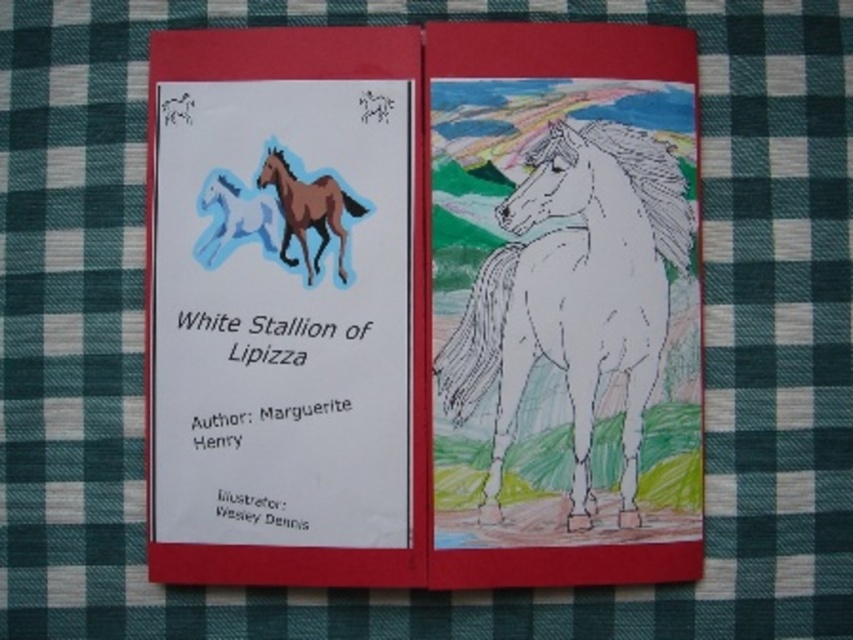
You are a child trying to see both the brown glossy horse at upper left and the blue paper horse at upper left. Which one is blocking your view of the other?

The brown glossy horse at upper left is in front of the blue paper horse at upper left, so it is blocking the view of the blue paper horse at upper left.

In the scene shown: You are holding a ruler that is 24 inches long. You want to measure the distance from your current position to the point marked as point (340, 218) in the image. Can you reach that point with your ruler?

The distance between point (340, 218) and the viewer is 24.42 inches. Since your ruler is only 24 inches long, it is not long enough to reach the point. You will need a longer ruler or measuring tool.

You are an art student analyzing the two booklets. You notice the white paper horse at center and the brown glossy horse at upper left. Which horse illustration is taller?

The white paper horse at center is taller than the brown glossy horse at upper left according to the description.